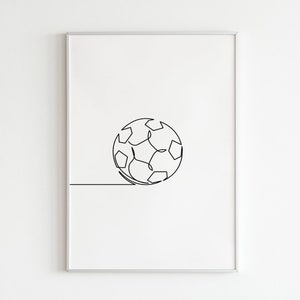
Image resolution: width=300 pixels, height=300 pixels. I want to click on artwork, so click(148, 235).